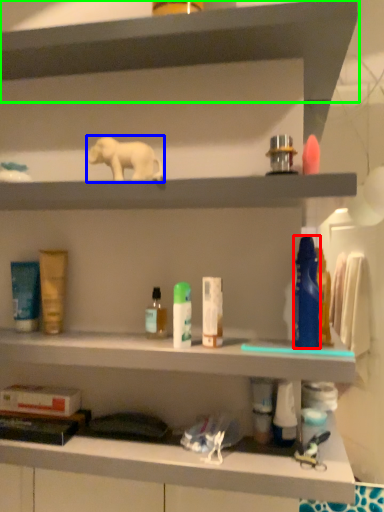
Question: Which is farther away from mouthwash (highlighted by a red box)? animal (highlighted by a blue box) or shelf (highlighted by a green box)?

Choices:
 (A) animal
 (B) shelf

Answer: (B)